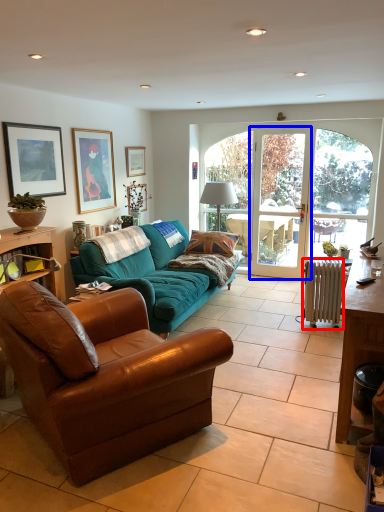
Question: Which object is further to the camera taking this photo, radiator (highlighted by a red box) or screen door (highlighted by a blue box)?

Choices:
 (A) radiator
 (B) screen door

Answer: (B)